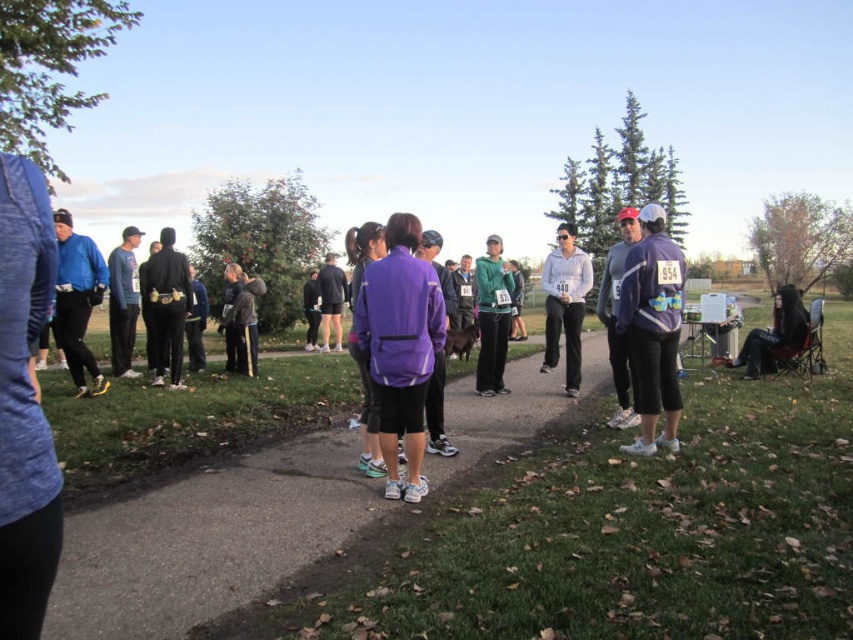
You are a photographer at the event and need to capture a clear shot of both the black fabric shorts at center and the matte black shorts at center. Which of the two should you focus on first to ensure they are in the frame without needing to adjust the camera angle?

The black fabric shorts at center is much taller than the matte black shorts at center, so you should focus on the black fabric shorts at center first to ensure it stays in frame without needing to adjust the camera angle.

You are a photographer at the event and need to capture a clear shot of the black fabric shorts at center and the matte black shorts at center. Which one is covering the other in the image?

The black fabric shorts at center is positioned under matte black shorts at center, so the matte black shorts at center is covering the black fabric shorts at center.

You are a photographer at the event and want to capture a photo that includes both the matte blue jacket at left and the matte white shirt at center. Based on their positions, which one should you focus on first to ensure both are in the frame?

The matte blue jacket at left is positioned on the left side of the matte white shirt at center, so focusing on the matte white shirt at center first will help ensure both are included in the frame.